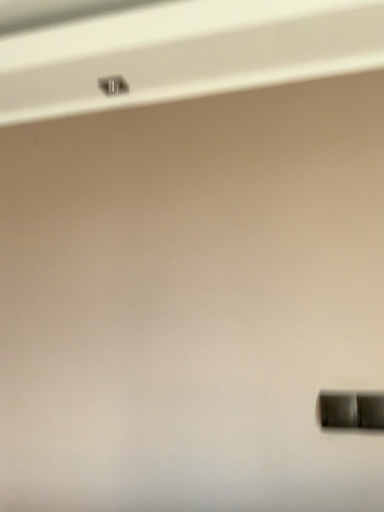
This screenshot has width=384, height=512. Describe the element at coordinates (351, 410) in the screenshot. I see `black plastic outlet at lower right` at that location.

You are a GUI agent. You are given a task and a screenshot of the screen. Output one action in this format:
    pyautogui.click(x=<x>, y=<y>)
    Task: Click on the black plastic outlet at lower right
    The height and width of the screenshot is (512, 384).
    Given the screenshot: What is the action you would take?
    pyautogui.click(x=351, y=410)

Measure the distance between point [323,416] and camera.

A distance of 38.50 inches exists between point [323,416] and camera.

You are a GUI agent. You are given a task and a screenshot of the screen. Output one action in this format:
    pyautogui.click(x=<x>, y=<y>)
    Task: Click on the black plastic outlet at lower right
    This screenshot has height=512, width=384.
    Given the screenshot: What is the action you would take?
    pyautogui.click(x=351, y=410)